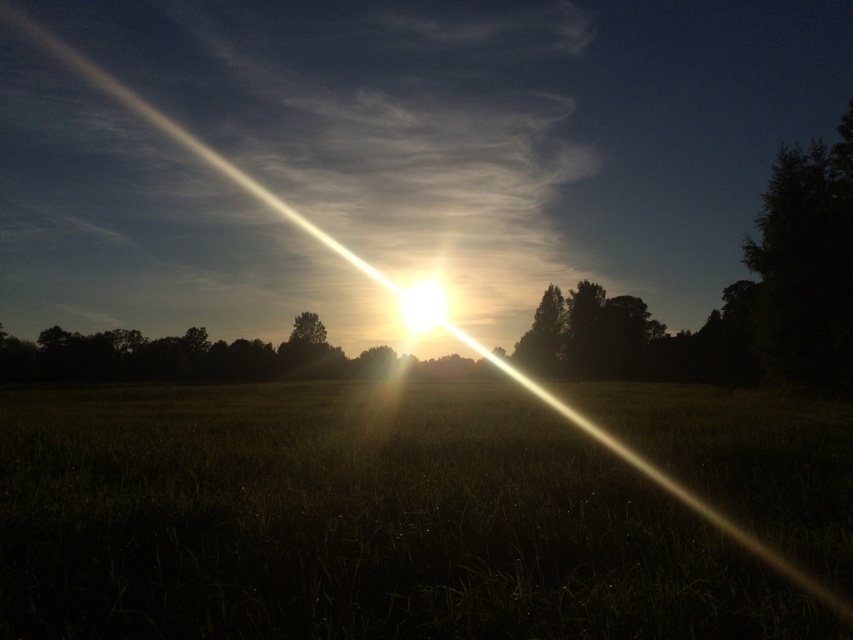
Question: Is green matte grass at center behind green leafy tree at center?

Choices:
 (A) no
 (B) yes

Answer: (A)

Question: Does green matte grass at center have a lesser width compared to green leafy tree at center?

Choices:
 (A) yes
 (B) no

Answer: (B)

Question: Which point is farther from the camera taking this photo?

Choices:
 (A) (552, 348)
 (B) (421, 566)

Answer: (A)

Question: Can you confirm if green matte grass at center is positioned to the left of green leafy tree at center?

Choices:
 (A) no
 (B) yes

Answer: (B)

Question: Which point is closer to the camera taking this photo?

Choices:
 (A) (131, 483)
 (B) (614, 372)

Answer: (A)